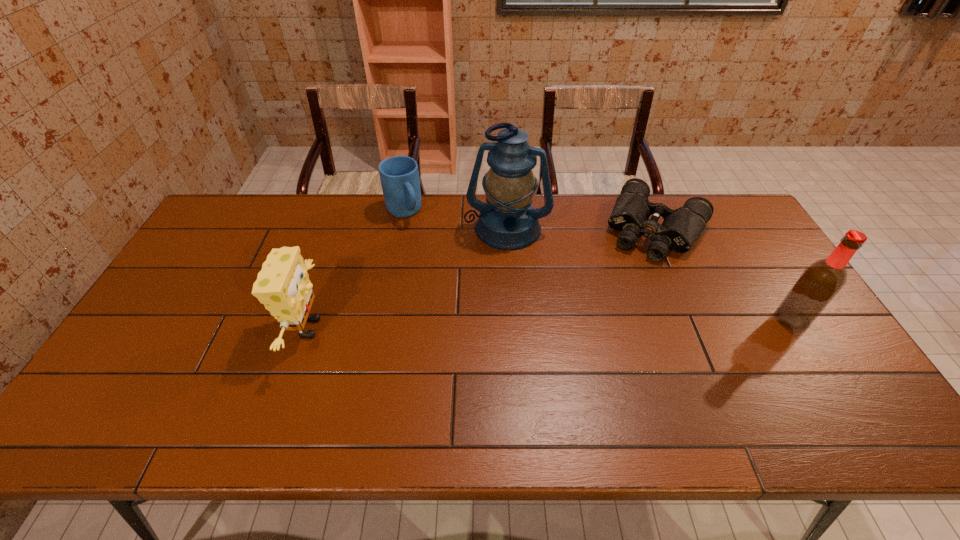
Locate an element on the screen. Image resolution: width=960 pixels, height=540 pixels. free space located 0.250m through the eyepieces of the shortest object is located at coordinates (615, 313).

Identify the location of lantern that is at the far edge. The height and width of the screenshot is (540, 960). (507, 221).

Where is `mug that is at the far edge`? This screenshot has width=960, height=540. mug that is at the far edge is located at coordinates (399, 175).

This screenshot has height=540, width=960. What are the coordinates of `binoculars positioned at the far edge` in the screenshot? It's located at (680, 229).

Image resolution: width=960 pixels, height=540 pixels. What are the coordinates of `object present at the near edge` in the screenshot? It's located at (283, 286).

Identify the location of beer bottle that is at the right edge. (819, 283).

Locate an element on the screen. Image resolution: width=960 pixels, height=540 pixels. binoculars present at the right edge is located at coordinates (680, 229).

Identify the location of object at the far right corner. (680, 229).

In the image, there is a desktop. What are the coordinates of `vacant area at the far edge` in the screenshot? It's located at (540, 197).

Identify the location of vacant space at the left edge of the desktop. This screenshot has height=540, width=960. point(163,341).